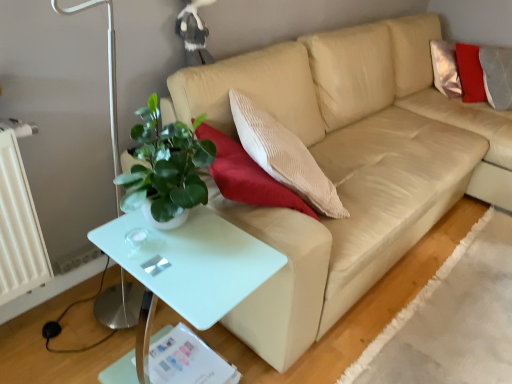
At what (x,y) coordinates should I click in order to perform the action: click on blank space above white glossy table at lower left (from a real-world perspective). Please return your answer as a coordinate pair (x, y). Looking at the image, I should click on (181, 251).